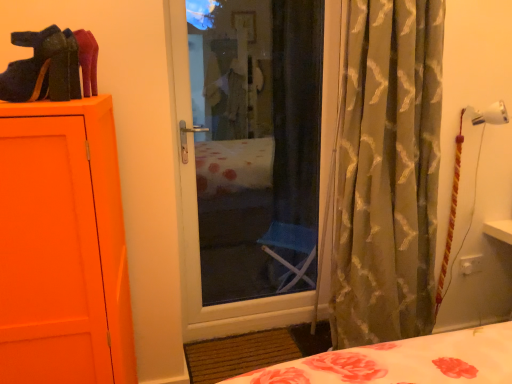
The image size is (512, 384). Describe the element at coordinates (38, 68) in the screenshot. I see `velvet-like black shoe at upper left` at that location.

Identify the location of velvet-like black shoe at upper left. The width and height of the screenshot is (512, 384). (38, 68).

What do you see at coordinates (387, 172) in the screenshot? The height and width of the screenshot is (384, 512). I see `silky green curtain at right` at bounding box center [387, 172].

Locate an element on the screen. The width and height of the screenshot is (512, 384). silky green curtain at right is located at coordinates (387, 172).

Find the location of a particular element. velvet-like black shoe at upper left is located at coordinates (38, 68).

Based on the photo, does silky green curtain at right appear on the right side of velvet-like black shoe at upper left?

Yes, silky green curtain at right is to the right of velvet-like black shoe at upper left.

Which object is closer to the camera taking this photo, silky green curtain at right or velvet-like black shoe at upper left?

Positioned in front is velvet-like black shoe at upper left.

Which is behind, point (368, 5) or point (3, 87)?

The point (368, 5) is farther from the camera.

From the image's perspective, relative to velvet-like black shoe at upper left, is silky green curtain at right above or below?

silky green curtain at right is below velvet-like black shoe at upper left.

From a real-world perspective, which object stands above the other?

In real-world perspective, velvet-like black shoe at upper left is above.

Is silky green curtain at right wider than velvet-like black shoe at upper left?

Indeed, silky green curtain at right has a greater width compared to velvet-like black shoe at upper left.

Consider the image. Who is taller, silky green curtain at right or velvet-like black shoe at upper left?

silky green curtain at right is taller.

Considering the sizes of objects silky green curtain at right and velvet-like black shoe at upper left in the image provided, who is bigger, silky green curtain at right or velvet-like black shoe at upper left?

silky green curtain at right is bigger.

Is silky green curtain at right inside or outside of velvet-like black shoe at upper left?

silky green curtain at right is outside velvet-like black shoe at upper left.

Would you consider silky green curtain at right to be distant from velvet-like black shoe at upper left?

silky green curtain at right is positioned a significant distance from velvet-like black shoe at upper left.

Is silky green curtain at right oriented away from velvet-like black shoe at upper left?

No, velvet-like black shoe at upper left is not at the back of silky green curtain at right.

Can you tell me how much silky green curtain at right and velvet-like black shoe at upper left differ in facing direction?

There is a 90-degree angle between the facing directions of silky green curtain at right and velvet-like black shoe at upper left.

Find the location of a particular element. This screenshot has height=384, width=512. shoe above the silky green curtain at right (from a real-world perspective) is located at coordinates (38, 68).

Considering the positions of objects velvet-like black shoe at upper left and silky green curtain at right in the image provided, who is more to the right, velvet-like black shoe at upper left or silky green curtain at right?

silky green curtain at right is more to the right.

Is the depth of velvet-like black shoe at upper left less than that of silky green curtain at right?

Yes, velvet-like black shoe at upper left is closer to the viewer.

Which is closer, (18,65) or (387,279)?

The point (18,65) is closer.

From the image's perspective, which object appears higher, velvet-like black shoe at upper left or silky green curtain at right?

velvet-like black shoe at upper left appears higher in the image.

From a real-world perspective, is velvet-like black shoe at upper left on silky green curtain at right?

Yes, from a real-world perspective, velvet-like black shoe at upper left is above silky green curtain at right.

Considering the sizes of objects velvet-like black shoe at upper left and silky green curtain at right in the image provided, who is wider, velvet-like black shoe at upper left or silky green curtain at right?

Wider between the two is silky green curtain at right.

Considering the relative sizes of velvet-like black shoe at upper left and silky green curtain at right in the image provided, is velvet-like black shoe at upper left shorter than silky green curtain at right?

Yes, velvet-like black shoe at upper left is shorter than silky green curtain at right.

Can you confirm if velvet-like black shoe at upper left is bigger than silky green curtain at right?

No.

Is velvet-like black shoe at upper left positioned beyond the bounds of silky green curtain at right?

Yes, velvet-like black shoe at upper left is outside of silky green curtain at right.

Is velvet-like black shoe at upper left next to silky green curtain at right and touching it?

No, velvet-like black shoe at upper left is not touching silky green curtain at right.

Is velvet-like black shoe at upper left oriented away from silky green curtain at right?

No, velvet-like black shoe at upper left is not facing the opposite direction of silky green curtain at right.

What's the angular difference between velvet-like black shoe at upper left and silky green curtain at right's facing directions?

velvet-like black shoe at upper left and silky green curtain at right are facing 90 degrees away from each other.

You are a GUI agent. You are given a task and a screenshot of the screen. Output one action in this format:
    pyautogui.click(x=<x>, y=<y>)
    Task: Click on the shoe above the silky green curtain at right (from a real-world perspective)
    
    Given the screenshot: What is the action you would take?
    pyautogui.click(x=38, y=68)

The width and height of the screenshot is (512, 384). Find the location of `shoe above the silky green curtain at right (from the image's perspective)`. shoe above the silky green curtain at right (from the image's perspective) is located at coordinates (38, 68).

The image size is (512, 384). Identify the location of shoe lying in front of the silky green curtain at right. (38, 68).